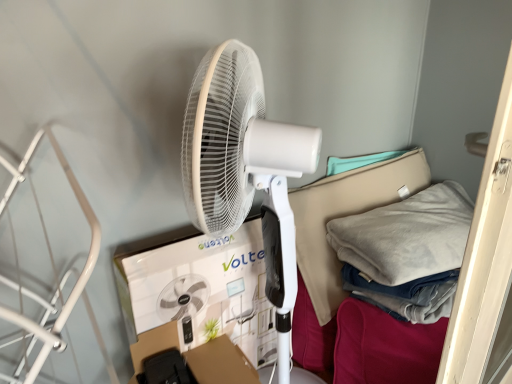
What do you see at coordinates (328, 245) in the screenshot? I see `beige fabric bed at center` at bounding box center [328, 245].

Find the location of `beige fabric bed at center`. beige fabric bed at center is located at coordinates (328, 245).

The width and height of the screenshot is (512, 384). I want to click on beige fabric bed at center, so click(328, 245).